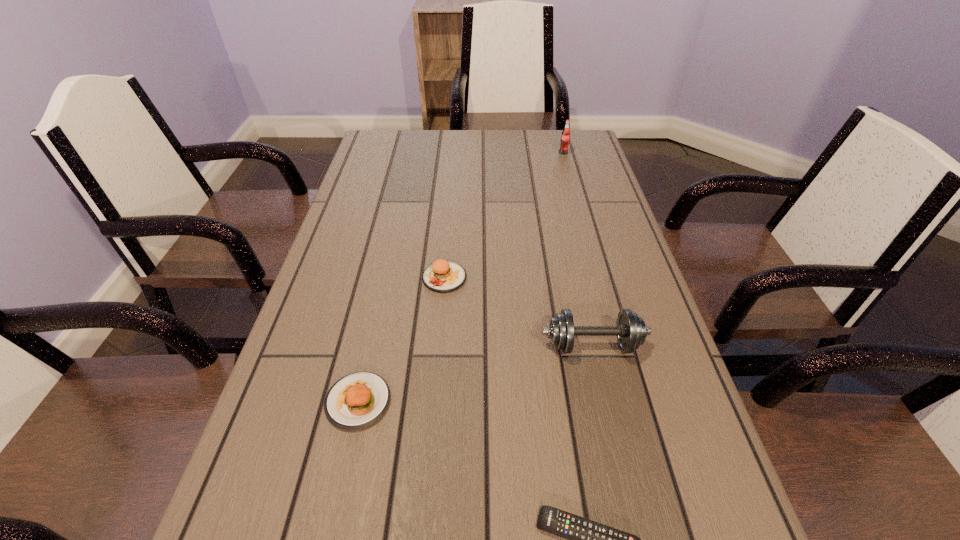
This screenshot has width=960, height=540. What are the coordinates of `vacant space situated 0.250m on the back of the farther food` in the screenshot? It's located at (450, 204).

You are a GUI agent. You are given a task and a screenshot of the screen. Output one action in this format:
    pyautogui.click(x=<x>, y=<y>)
    Task: Click on the blank area located on the right of the left food
    
    Given the screenshot: What is the action you would take?
    pyautogui.click(x=479, y=401)

Where is `object that is at the far edge`? This screenshot has height=540, width=960. object that is at the far edge is located at coordinates (565, 137).

Identify the location of object that is at the left edge. (357, 400).

The width and height of the screenshot is (960, 540). Find the location of `soda bottle that is at the right edge`. soda bottle that is at the right edge is located at coordinates click(565, 137).

Locate an element on the screen. dumbbell that is at the right edge is located at coordinates (631, 331).

Where is `object at the far right corner`? object at the far right corner is located at coordinates (565, 137).

The image size is (960, 540). Find the location of `free space at the far edge of the desktop`. free space at the far edge of the desktop is located at coordinates (498, 146).

The width and height of the screenshot is (960, 540). In the image, there is a desktop. In order to click on vacant space at the left edge in this screenshot , I will do `click(265, 457)`.

In the image, there is a desktop. Identify the location of vacant space at the right edge. (585, 179).